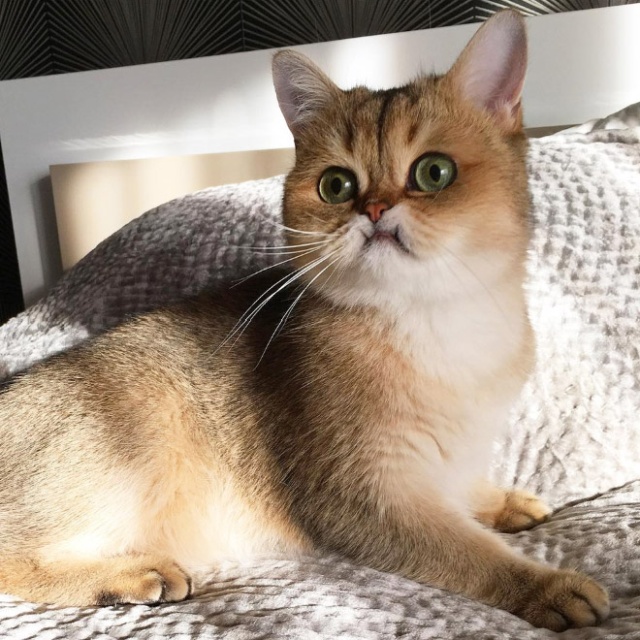
The image size is (640, 640). Find the location of `bed`. bed is located at coordinates (588, 509).